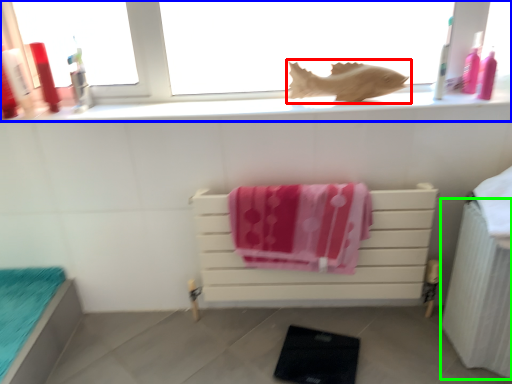
Question: Which object is positioned closest to animal (highlighted by a red box)? Select from window (highlighted by a blue box) and radiator (highlighted by a green box).

Choices:
 (A) window
 (B) radiator

Answer: (A)